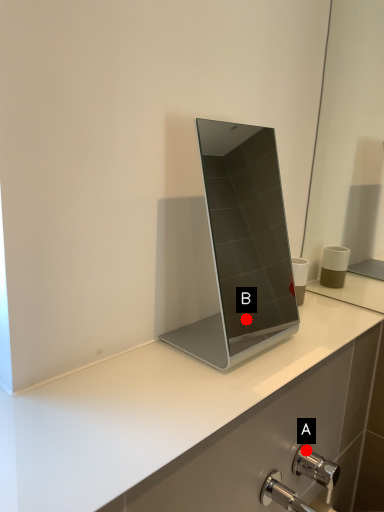
Question: Two points are circled on the image, labeled by A and B beside each circle. Which point is closer to the camera taking this photo?

Choices:
 (A) A is closer
 (B) B is closer

Answer: (A)